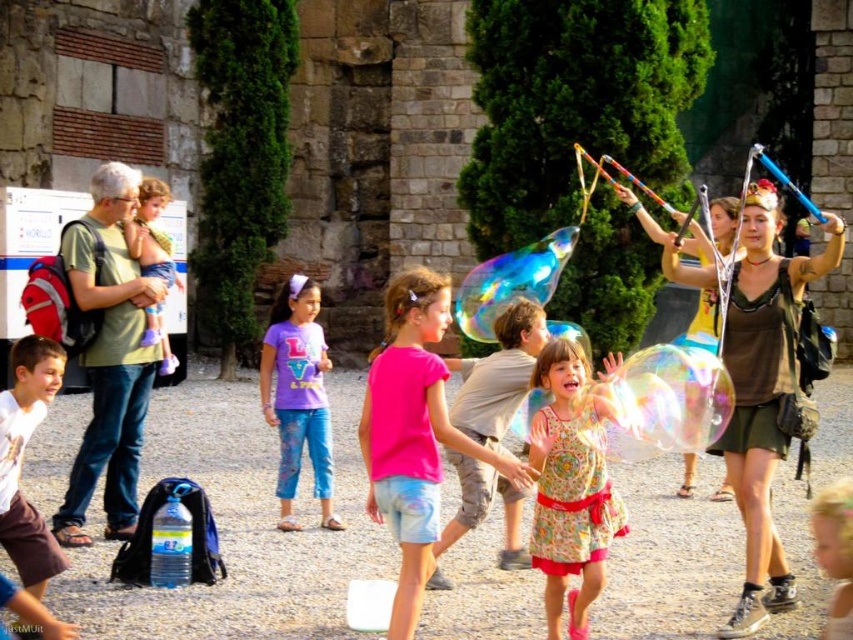
Is purple matte shirt at center shorter than matte blue shirt at left?

Incorrect, purple matte shirt at center's height does not fall short of matte blue shirt at left's.

The height and width of the screenshot is (640, 853). What do you see at coordinates (299, 396) in the screenshot?
I see `purple matte shirt at center` at bounding box center [299, 396].

Where is `purple matte shirt at center`? This screenshot has height=640, width=853. purple matte shirt at center is located at coordinates (299, 396).

In the scene shown: Is matte brown dress at center smaller than white cotton shirt at center?

No, matte brown dress at center is not smaller than white cotton shirt at center.

Is point (759, 285) closer to camera compared to point (9, 540)?

No, (759, 285) is further to viewer.

You are a GUI agent. You are given a task and a screenshot of the screen. Output one action in this format:
    pyautogui.click(x=<x>, y=<y>)
    Task: Click on the matte brown dress at center
    The height and width of the screenshot is (640, 853).
    Given the screenshot: What is the action you would take?
    pyautogui.click(x=759, y=384)

Which is above, matte brown dress at center or purple matte shirt at center?

matte brown dress at center is higher up.

What do you see at coordinates (759, 384) in the screenshot?
I see `matte brown dress at center` at bounding box center [759, 384].

Is point (734, 429) positioned after point (282, 417)?

No, it is in front of (282, 417).

The width and height of the screenshot is (853, 640). Find the location of `matte brown dress at center`. matte brown dress at center is located at coordinates (759, 384).